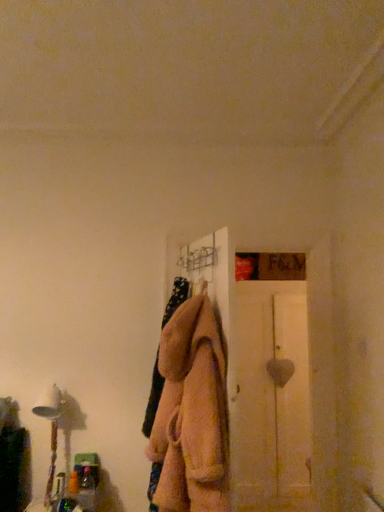
Question: Should I look upward or downward to see white wooden door at right?

Choices:
 (A) up
 (B) down

Answer: (B)

Question: Should I look upward or downward to see white fabric lampshade at left?

Choices:
 (A) down
 (B) up

Answer: (A)

Question: Is white wooden door at right looking in the opposite direction of fuzzy beige coat at center?

Choices:
 (A) no
 (B) yes

Answer: (A)

Question: Does white wooden door at right have a smaller size compared to fuzzy beige coat at center?

Choices:
 (A) yes
 (B) no

Answer: (B)

Question: Is the depth of white wooden door at right greater than that of fuzzy beige coat at center?

Choices:
 (A) yes
 (B) no

Answer: (A)

Question: Does white wooden door at right have a greater width compared to fuzzy beige coat at center?

Choices:
 (A) yes
 (B) no

Answer: (A)

Question: Would you say white wooden door at right is outside fuzzy beige coat at center?

Choices:
 (A) yes
 (B) no

Answer: (A)

Question: Considering the relative positions of white wooden door at right and fuzzy beige coat at center in the image provided, is white wooden door at right in front of fuzzy beige coat at center?

Choices:
 (A) yes
 (B) no

Answer: (B)

Question: Is white fabric lampshade at left taller than fuzzy beige coat at center?

Choices:
 (A) yes
 (B) no

Answer: (B)

Question: Can you confirm if white fabric lampshade at left is shorter than fuzzy beige coat at center?

Choices:
 (A) no
 (B) yes

Answer: (B)

Question: Is white fabric lampshade at left at the left side of fuzzy beige coat at center?

Choices:
 (A) no
 (B) yes

Answer: (B)

Question: Is white fabric lampshade at left smaller than fuzzy beige coat at center?

Choices:
 (A) no
 (B) yes

Answer: (B)

Question: From a real-world perspective, is white fabric lampshade at left located higher than fuzzy beige coat at center?

Choices:
 (A) no
 (B) yes

Answer: (A)

Question: Is white fabric lampshade at left facing towards fuzzy beige coat at center?

Choices:
 (A) yes
 (B) no

Answer: (B)

Question: Could you tell me if white wooden door at right is turned towards white fabric lampshade at left?

Choices:
 (A) yes
 (B) no

Answer: (B)